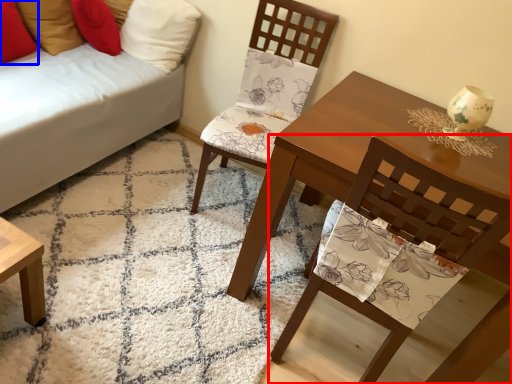
Question: Which point is further to the camera, chair (highlighted by a red box) or pillow (highlighted by a blue box)?

Choices:
 (A) chair
 (B) pillow

Answer: (B)